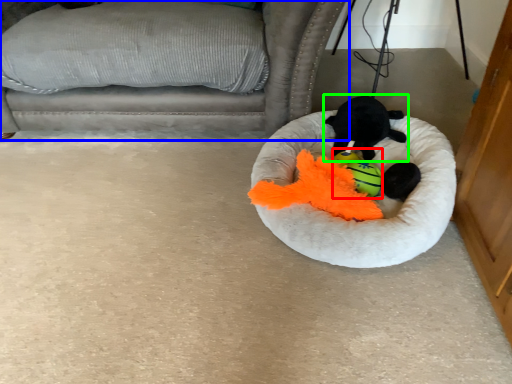
Question: Based on their relative distances, which object is nearer to toy (highlighted by a red box)? Choose from furniture (highlighted by a blue box) and toy (highlighted by a green box).

Choices:
 (A) furniture
 (B) toy

Answer: (B)